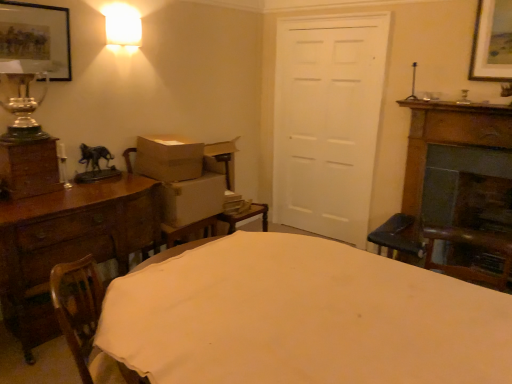
Identify the location of blank space above matte black picture frame at upper left (from a real-world perspective). (26, 8).